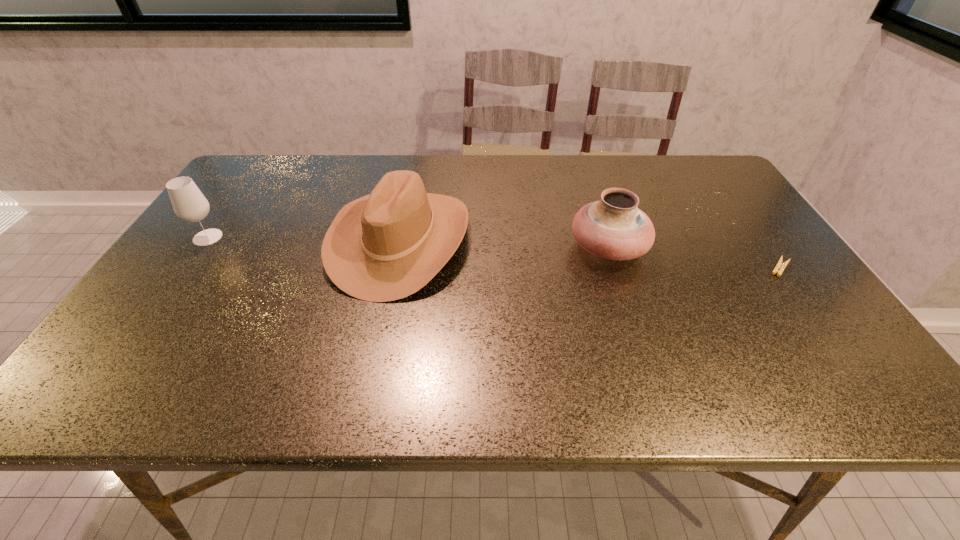
Find the location of `glass`. glass is located at coordinates (189, 204).

Find the location of a particular element. Image resolution: width=960 pixels, height=540 pixels. cowboy hat is located at coordinates (387, 245).

The height and width of the screenshot is (540, 960). I want to click on the third object from left to right, so click(613, 228).

The image size is (960, 540). Find the location of `clothespin`. clothespin is located at coordinates (780, 264).

This screenshot has height=540, width=960. What are the coordinates of `the shortest object` in the screenshot? It's located at (780, 264).

The height and width of the screenshot is (540, 960). Find the location of `free space located 0.380m on the right of the glass`. free space located 0.380m on the right of the glass is located at coordinates (361, 238).

This screenshot has height=540, width=960. I want to click on vacant region located on the left of the third object from right to left, so click(x=277, y=240).

Locate an element on the screen. vacant space located on the front of the second object from right to left is located at coordinates (621, 289).

Where is `vacant space located 0.280m on the left of the shortest object`? vacant space located 0.280m on the left of the shortest object is located at coordinates (656, 268).

This screenshot has height=540, width=960. In order to click on object located at the far edge in this screenshot , I will do [387, 245].